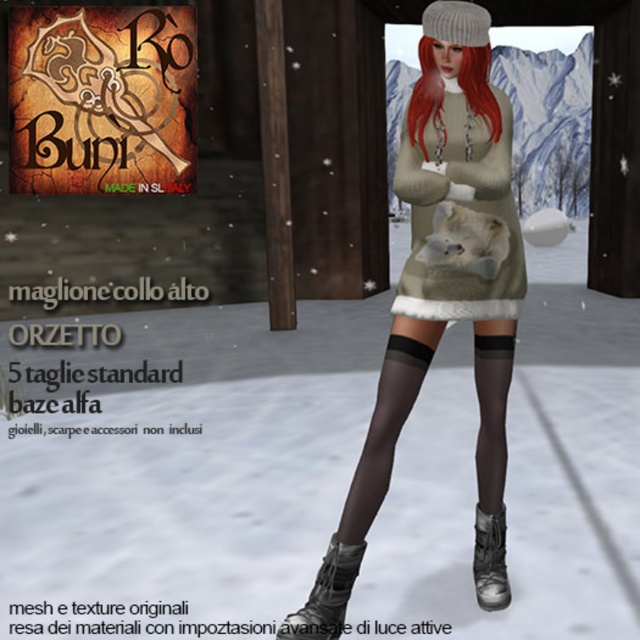
Question: Which object appears closest to the camera in this image?

Choices:
 (A) leather boots at lower center
 (B) fuzzy beige sweater at center
 (C) matte black boot at lower center
 (D) white fluffy snow at center

Answer: (A)

Question: Does white fluffy snow at center have a smaller size compared to matte black boot at lower center?

Choices:
 (A) no
 (B) yes

Answer: (A)

Question: Can you confirm if white fluffy snow at center is positioned below knitted beige dress with fox at center?

Choices:
 (A) yes
 (B) no

Answer: (A)

Question: Which of these objects is positioned closest to the fuzzy beige sweater at center?

Choices:
 (A) white fluffy snow at center
 (B) leather boots at lower center

Answer: (B)

Question: Can you confirm if white fluffy snow at center is positioned above fuzzy beige sweater at center?

Choices:
 (A) yes
 (B) no

Answer: (B)

Question: Which object is the farthest from the white fluffy snow at center?

Choices:
 (A) leather boots at lower center
 (B) matte black boot at lower center
 (C) knitted beige dress with fox at center
 (D) fuzzy beige sweater at center

Answer: (C)